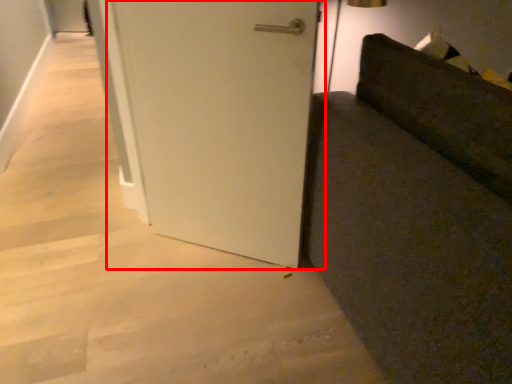
Question: Considering the relative positions of door (annotated by the red box) and furniture in the image provided, where is door (annotated by the red box) located with respect to the staircase?

Choices:
 (A) left
 (B) right

Answer: (A)